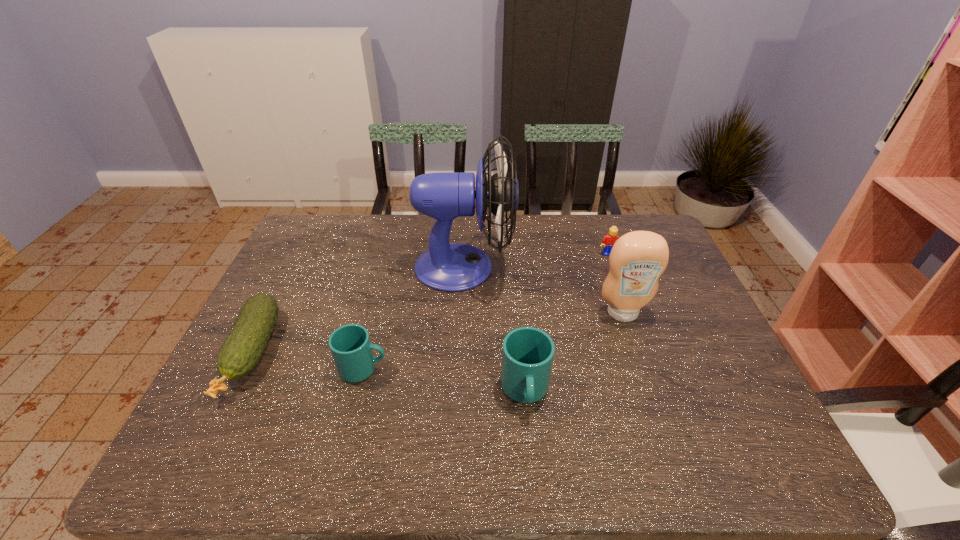
Please point a vacant point for placing a cup on the right. Please provide its 2D coordinates. Your answer should be formatted as a tuple, i.e. [(x, y)], where the tuple contains the x and y coordinates of a point satisfying the conditions above.

[(703, 416)]